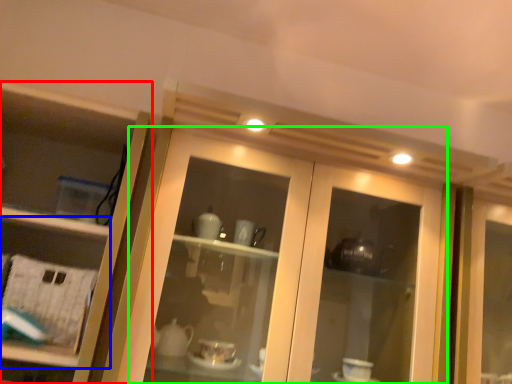
Question: Which object is the closest to the cupboard (highlighted by a red box)? Choose among these: shelf (highlighted by a blue box) or door (highlighted by a green box).

Choices:
 (A) shelf
 (B) door

Answer: (A)